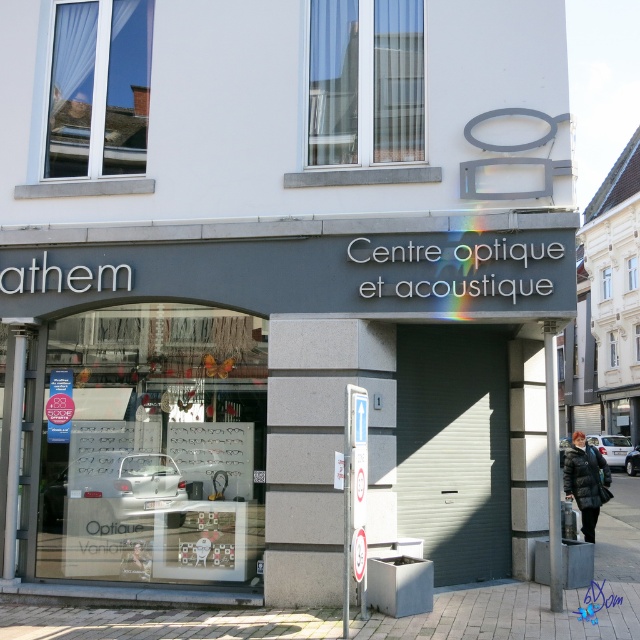
Which is more to the left, brick pavement at lower center or dark blue puffer jacket at lower right?

Positioned to the left is brick pavement at lower center.

Is brick pavement at lower center wider than dark blue puffer jacket at lower right?

No, brick pavement at lower center is not wider than dark blue puffer jacket at lower right.

Who is more forward, (538,636) or (580,506)?

Point (538,636) is more forward.

Where is `brick pavement at lower center`? brick pavement at lower center is located at coordinates (536, 593).

Is matte gray storefront at center to the right of brick pavement at lower center from the viewer's perspective?

No, matte gray storefront at center is not to the right of brick pavement at lower center.

Does matte gray storefront at center appear on the left side of brick pavement at lower center?

Indeed, matte gray storefront at center is positioned on the left side of brick pavement at lower center.

Describe the element at coordinates (289, 387) in the screenshot. I see `matte gray storefront at center` at that location.

This screenshot has width=640, height=640. In order to click on matte gray storefront at center in this screenshot , I will do (289, 387).

Can you confirm if matte gray storefront at center is positioned above dark blue puffer jacket at lower right?

Indeed, matte gray storefront at center is positioned over dark blue puffer jacket at lower right.

Does matte gray storefront at center have a greater width compared to dark blue puffer jacket at lower right?

No.

This screenshot has width=640, height=640. Describe the element at coordinates (289, 387) in the screenshot. I see `matte gray storefront at center` at that location.

Find the location of a particular element. This screenshot has height=640, width=640. matte gray storefront at center is located at coordinates (289, 387).